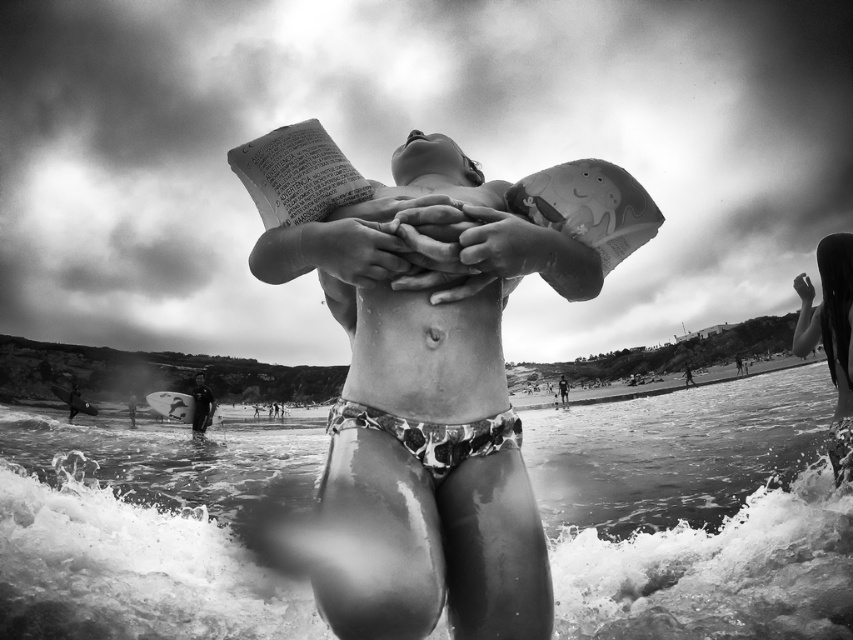
Question: From the image, what is the correct spatial relationship of smooth skin child at right in relation to smooth black wetsuit at lower left?

Choices:
 (A) left
 (B) right

Answer: (B)

Question: Which object is farther from the camera taking this photo?

Choices:
 (A) wet sand at lower center
 (B) printed fabric bikini at center

Answer: (A)

Question: Can you confirm if printed paper towel at center is positioned below printed fabric bikini at center?

Choices:
 (A) no
 (B) yes

Answer: (A)

Question: Among these objects, which one is farthest from the camera?

Choices:
 (A) printed fabric bikini at center
 (B) smooth skin child at right
 (C) smooth black wetsuit at lower left

Answer: (C)

Question: Which point is closer to the camera?

Choices:
 (A) (242, 593)
 (B) (799, 330)
 (C) (460, 452)

Answer: (C)

Question: Can you confirm if wet sand at lower center is positioned above smooth skin child at right?

Choices:
 (A) no
 (B) yes

Answer: (A)